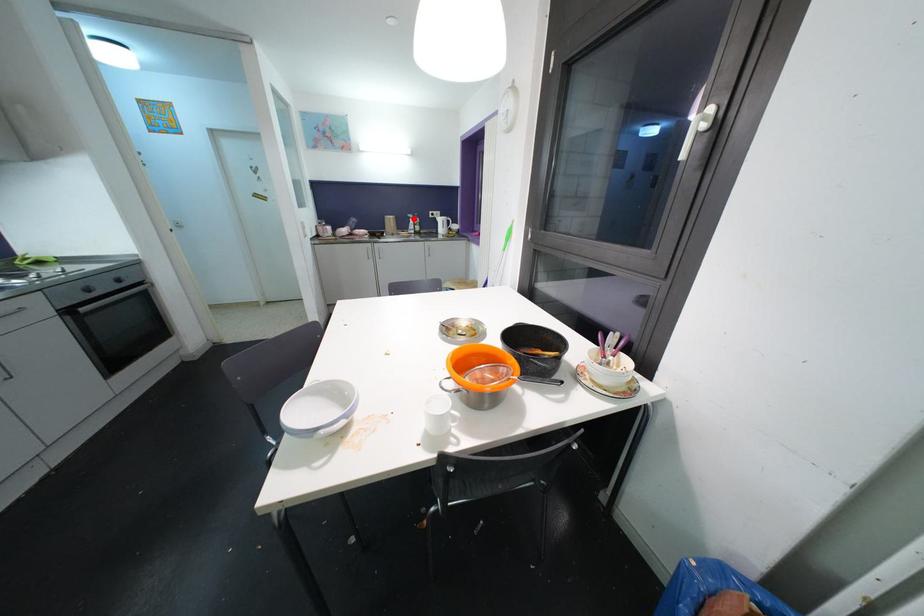
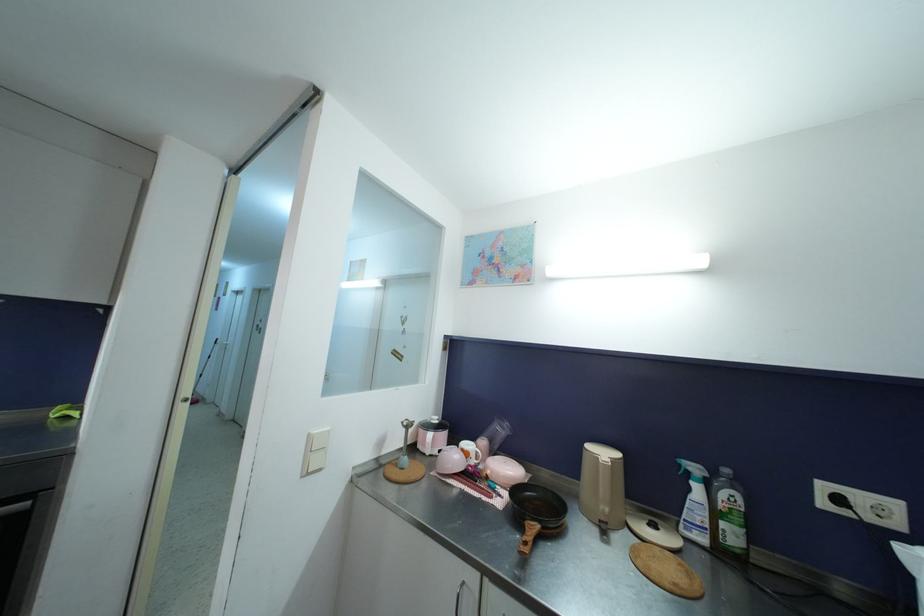
Find the pixel in the second image that matches the highlighted location in the first image.

(699, 472)